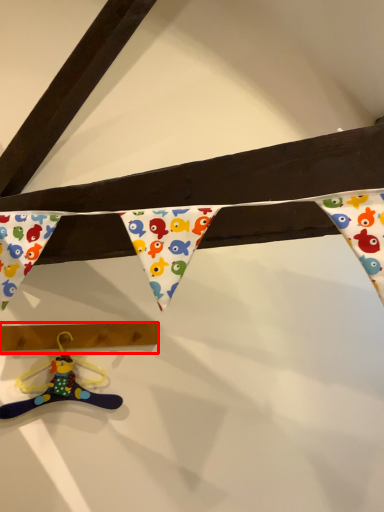
Question: From the image, what is the correct spatial relationship of plank (annotated by the red box) in relation to toy?

Choices:
 (A) right
 (B) left

Answer: (A)